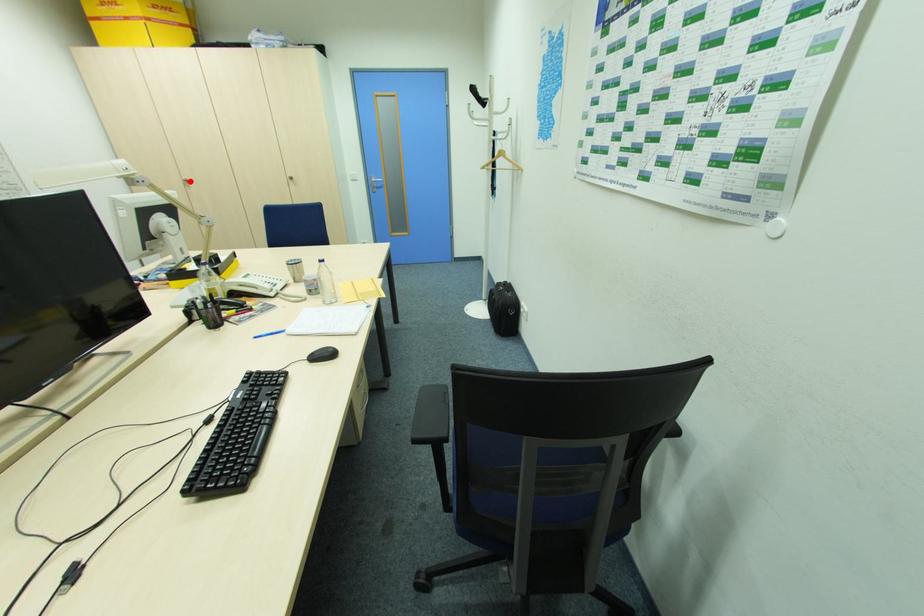
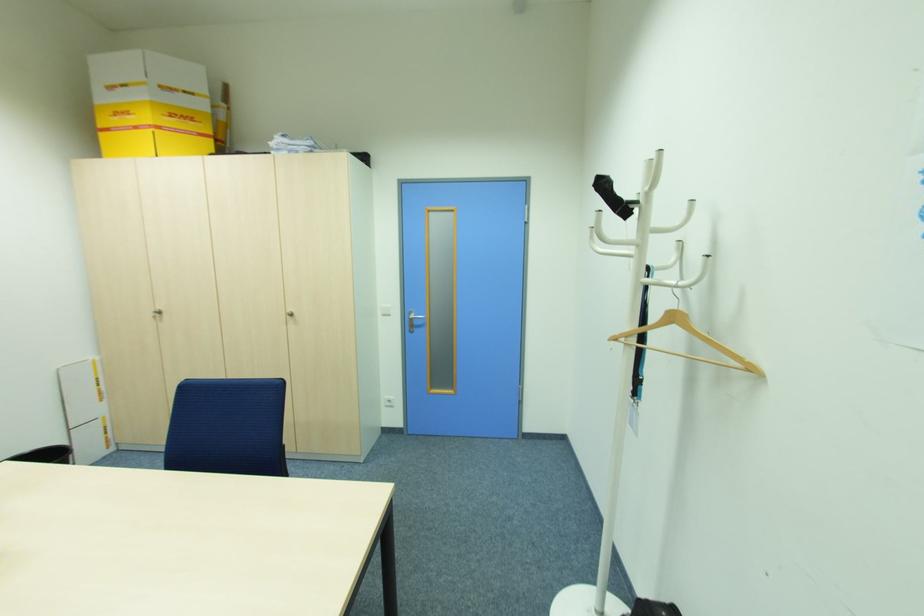
The point at the highlighted location is marked in the first image. Where is the corresponding point in the second image?

(162, 312)